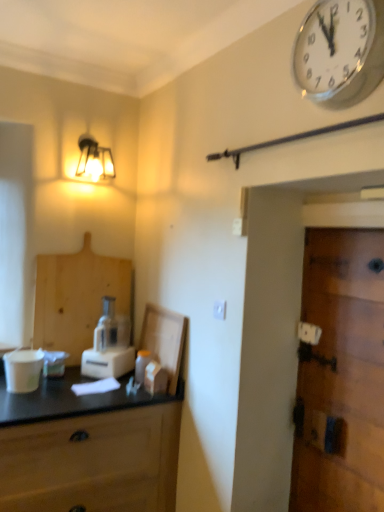
What is the approximate width of white plastic electric outlet at center?

0.52 inches.

Find the location of `wooden cutting board at left`. wooden cutting board at left is located at coordinates (78, 298).

What do you see at coordinates (78, 298) in the screenshot? This screenshot has width=384, height=512. I see `wooden cutting board at left` at bounding box center [78, 298].

Image resolution: width=384 pixels, height=512 pixels. What do you see at coordinates (94, 160) in the screenshot? I see `matte glass lamp at upper left` at bounding box center [94, 160].

Locate an element on the screen. The height and width of the screenshot is (512, 384). white glossy wall clock at upper right is located at coordinates (340, 52).

I want to click on door below the white glossy wall clock at upper right (from a real-world perspective), so 341,375.

Is wooden door at right aimed at white glossy wall clock at upper right?

No, wooden door at right is not aimed at white glossy wall clock at upper right.

From the image's perspective, which object appears higher, wooden door at right or white glossy wall clock at upper right?

From the image's view, white glossy wall clock at upper right is above.

In the scene shown: Is wooden door at right not inside white glossy wall clock at upper right?

Absolutely, wooden door at right is external to white glossy wall clock at upper right.

Consider the image. From the image's perspective, which object appears higher, white plastic blender at center or matte glass lamp at upper left?

matte glass lamp at upper left.

In the scene shown: Which of these two, white plastic blender at center or matte glass lamp at upper left, is wider?

white plastic blender at center.

Is point (108, 329) farther from viewer compared to point (87, 164)?

No, it is in front of (87, 164).

Does translucent plastic bottle at center turn towards matte glass lamp at upper left?

No, translucent plastic bottle at center does not turn towards matte glass lamp at upper left.

From the image's perspective, is translucent plastic bottle at center above matte glass lamp at upper left?

No.

Based on the photo, would you say translucent plastic bottle at center is a long distance from matte glass lamp at upper left?

translucent plastic bottle at center is far away from matte glass lamp at upper left.

Considering the relative positions of wooden cutting board at left and wooden door at right in the image provided, is wooden cutting board at left to the left or to the right of wooden door at right?

In the image, wooden cutting board at left appears on the left side of wooden door at right.

How distant is wooden cutting board at left from wooden door at right?

The distance of wooden cutting board at left from wooden door at right is 4.40 feet.

Find the location of `door that is in front of the wooden cutting board at left`. door that is in front of the wooden cutting board at left is located at coordinates (341, 375).

Between wooden door at right and wooden cutting board at left, which one has less height?

wooden cutting board at left.

Find the location of a particular element. The height and width of the screenshot is (512, 384). cabinetry to the left of wooden door at right is located at coordinates (78, 298).

Which object is more forward, wooden door at right or wooden cutting board at left?

wooden door at right is in front.

Is wooden door at right positioned with its back to wooden cutting board at left?

No, wooden door at right is not facing the opposite direction of wooden cutting board at left.

Can we say white plastic blender at center lies outside translucent plastic bottle at center?

Yes, white plastic blender at center is located beyond the bounds of translucent plastic bottle at center.

Between white plastic blender at center and translucent plastic bottle at center, which one has more height?

white plastic blender at center.

Consider the image. From a real-world perspective, is white plastic blender at center on translucent plastic bottle at center?

Yes, from a real-world perspective, white plastic blender at center is over translucent plastic bottle at center

Where is `toiletry beneath the white plastic blender at center (from a real-world perspective)`? This screenshot has height=512, width=384. toiletry beneath the white plastic blender at center (from a real-world perspective) is located at coordinates (141, 365).

This screenshot has width=384, height=512. What are the coordinates of `lamp below the white glossy wall clock at upper right (from a real-world perspective)` in the screenshot? It's located at (94, 160).

Considering the relative sizes of white glossy wall clock at upper right and matte glass lamp at upper left in the image provided, is white glossy wall clock at upper right taller than matte glass lamp at upper left?

Yes, white glossy wall clock at upper right is taller than matte glass lamp at upper left.

Between white glossy wall clock at upper right and matte glass lamp at upper left, which one is positioned behind?

matte glass lamp at upper left.

In the image, there is a wooden door at right. What are the coordinates of `wall clock above it (from the image's perspective)` in the screenshot? It's located at tap(340, 52).

Image resolution: width=384 pixels, height=512 pixels. Find the location of `lamp that is above the white plastic blender at center (from a real-world perspective)`. lamp that is above the white plastic blender at center (from a real-world perspective) is located at coordinates (94, 160).

Estimate the real-world distances between objects in this image. Which object is closer to white plastic blender at center, white plastic electric outlet at center or wooden door at right?

Among the two, white plastic electric outlet at center is located nearer to white plastic blender at center.

Considering their positions, is white plastic electric outlet at center positioned further to wooden cutting board at left than white glossy wall clock at upper right?

white glossy wall clock at upper right lies further to wooden cutting board at left than the other object.

Considering their positions, is wooden door at right positioned closer to white glossy wall clock at upper right than matte glass lamp at upper left?

Based on the image, wooden door at right appears to be nearer to white glossy wall clock at upper right.

Estimate the real-world distances between objects in this image. Which object is further from white plastic electric outlet at center, matte glass lamp at upper left or white glossy wall clock at upper right?

matte glass lamp at upper left lies further to white plastic electric outlet at center than the other object.

Considering their positions, is white glossy wall clock at upper right positioned closer to white plastic electric outlet at center than wooden cutting board at left?

Among the two, wooden cutting board at left is located nearer to white plastic electric outlet at center.

From the image, which object appears to be nearer to wooden cutting board at left, white plastic electric outlet at center or wooden door at right?

white plastic electric outlet at center is closer to wooden cutting board at left.

When comparing their distances from translucent plastic bottle at center, does white plastic electric outlet at center or white glossy wall clock at upper right seem further?

white glossy wall clock at upper right lies further to translucent plastic bottle at center than the other object.

Estimate the real-world distances between objects in this image. Which object is closer to white plastic blender at center, matte glass lamp at upper left or white plastic electric outlet at center?

white plastic electric outlet at center lies closer to white plastic blender at center than the other object.

Identify the location of electric outlet between matte glass lamp at upper left and wooden cutting board at left from top to bottom. Image resolution: width=384 pixels, height=512 pixels. (219, 310).

This screenshot has height=512, width=384. Identify the location of cabinetry between matte glass lamp at upper left and white plastic blender at center in the up-down direction. (78, 298).

Find the location of a particular element. electric outlet between matte glass lamp at upper left and translucent plastic bottle at center in the up-down direction is located at coordinates (219, 310).

You are a GUI agent. You are given a task and a screenshot of the screen. Output one action in this format:
    pyautogui.click(x=<x>, y=<y>)
    Task: Click on the toiletry between white glossy wall clock at upper right and wooden cutting board at left along the z-axis
    This screenshot has width=384, height=512.
    Given the screenshot: What is the action you would take?
    pyautogui.click(x=141, y=365)